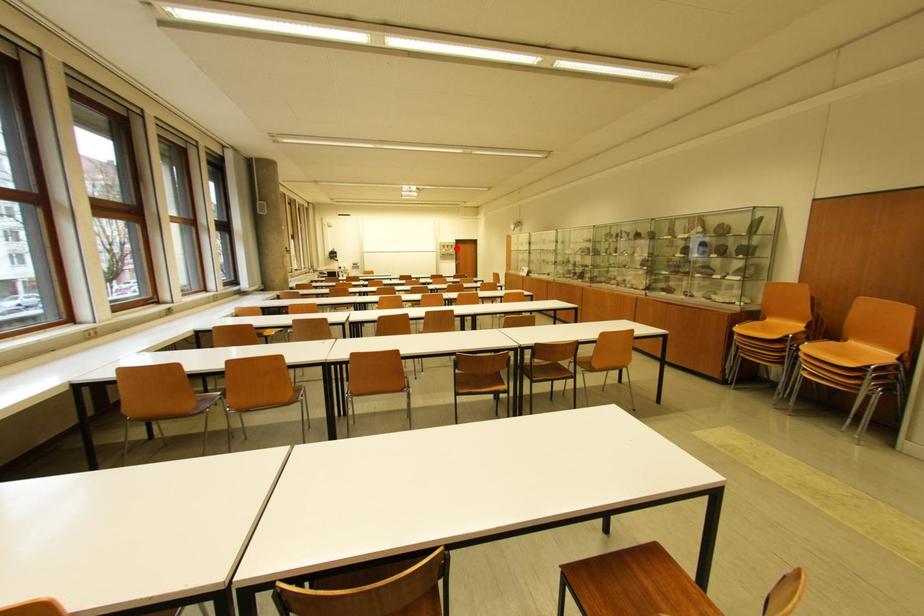
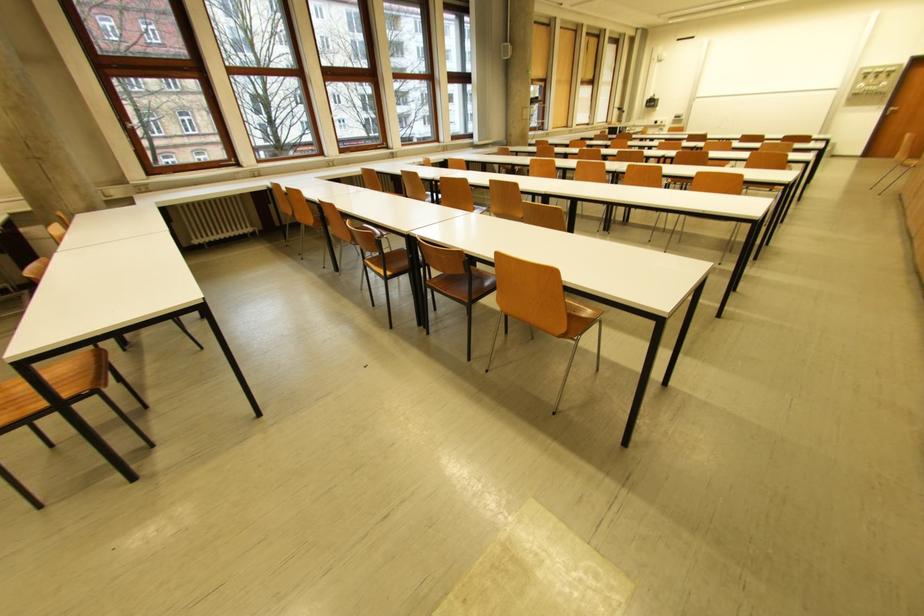
Question: I am providing you with two images of the same scene from different viewpoints. Image1 has a red point marked. In image2, the corresponding 3D location appears at what relative position? Reply with the corresponding letter.

Choices:
 (A) Closer
 (B) Farther

Answer: (B)